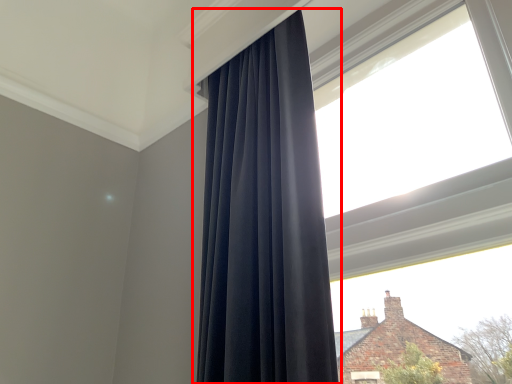
Question: From the image, what is the correct spatial relationship of curtain (annotated by the red box) in relation to window?

Choices:
 (A) right
 (B) left

Answer: (B)